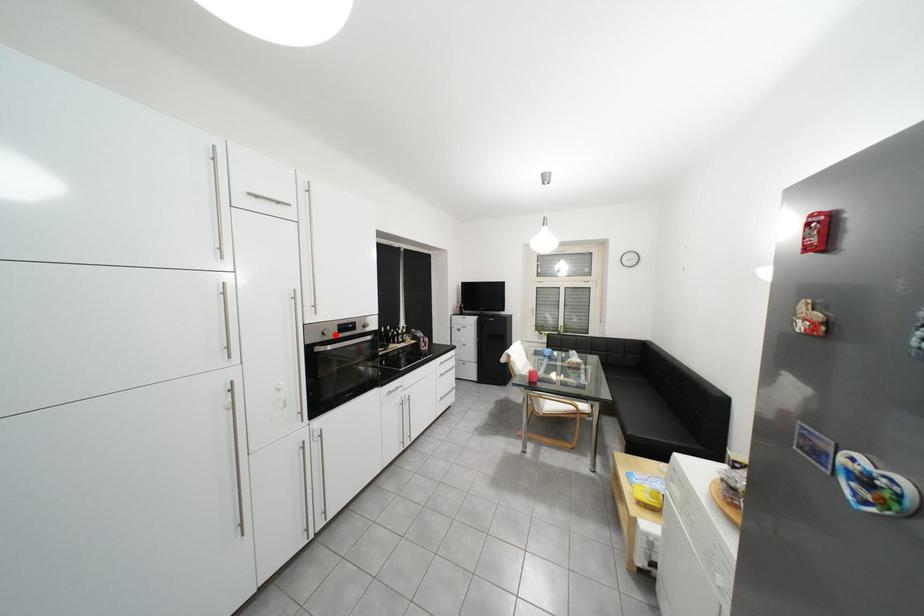
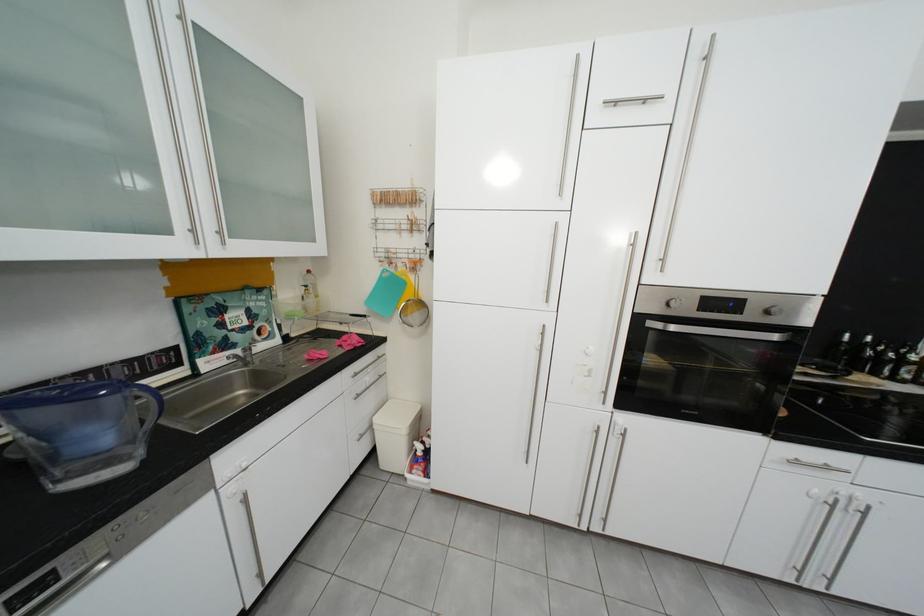
Find the pixel in the second image that matches the highlighted location in the first image.

(679, 306)